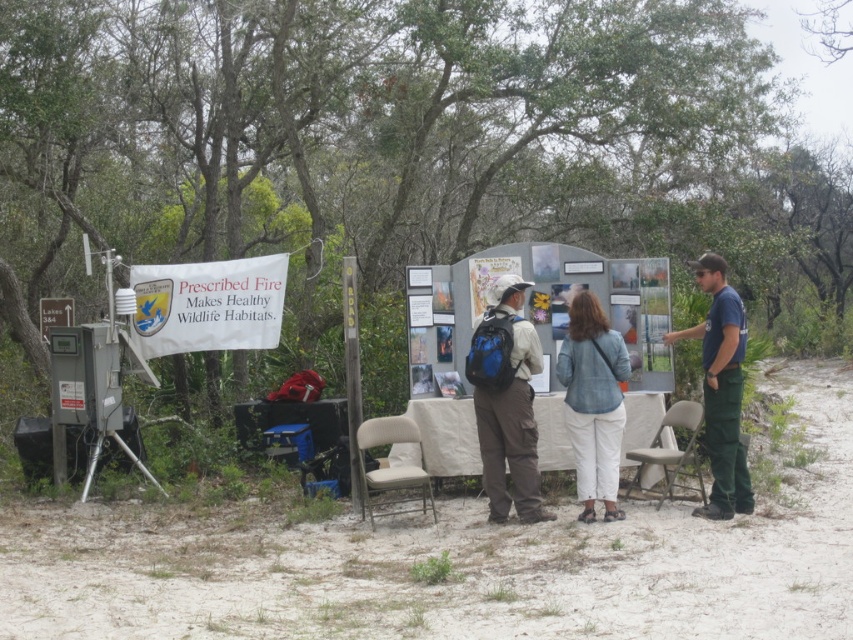
Does khaki fabric pants at center appear under denim jacket at center?

No.

This screenshot has width=853, height=640. What do you see at coordinates (506, 401) in the screenshot?
I see `khaki fabric pants at center` at bounding box center [506, 401].

Which is in front, point (509, 365) or point (622, 376)?

Positioned in front is point (509, 365).

Find the location of a particular element. The height and width of the screenshot is (640, 853). khaki fabric pants at center is located at coordinates (506, 401).

At what (x,y) coordinates should I click in order to perform the action: click on denim jacket at center. Please return your answer as a coordinate pair (x, y). The width and height of the screenshot is (853, 640). Looking at the image, I should click on (593, 403).

The width and height of the screenshot is (853, 640). What do you see at coordinates (593, 403) in the screenshot? I see `denim jacket at center` at bounding box center [593, 403].

I want to click on denim jacket at center, so click(x=593, y=403).

Does point (524, 561) come behind point (506, 384)?

No.

The height and width of the screenshot is (640, 853). In order to click on dirt field at lower center in this screenshot , I will do `click(453, 564)`.